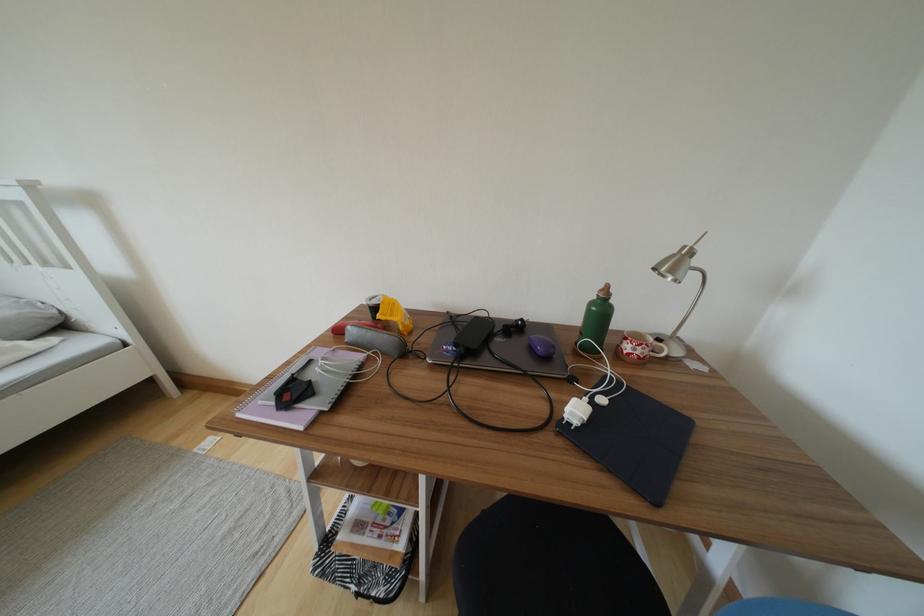
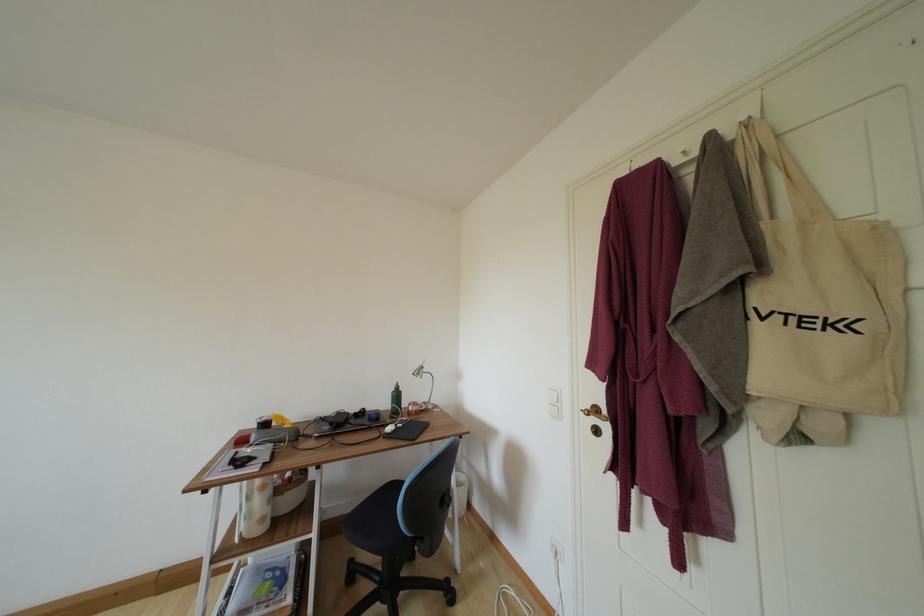
In the second image, find the point that corresponds to point (597, 307) in the first image.

(398, 395)